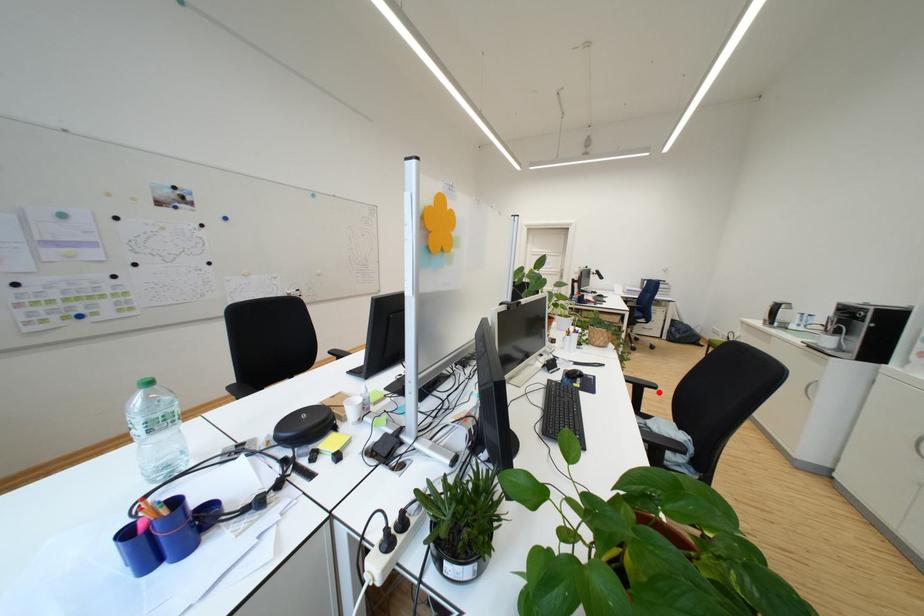
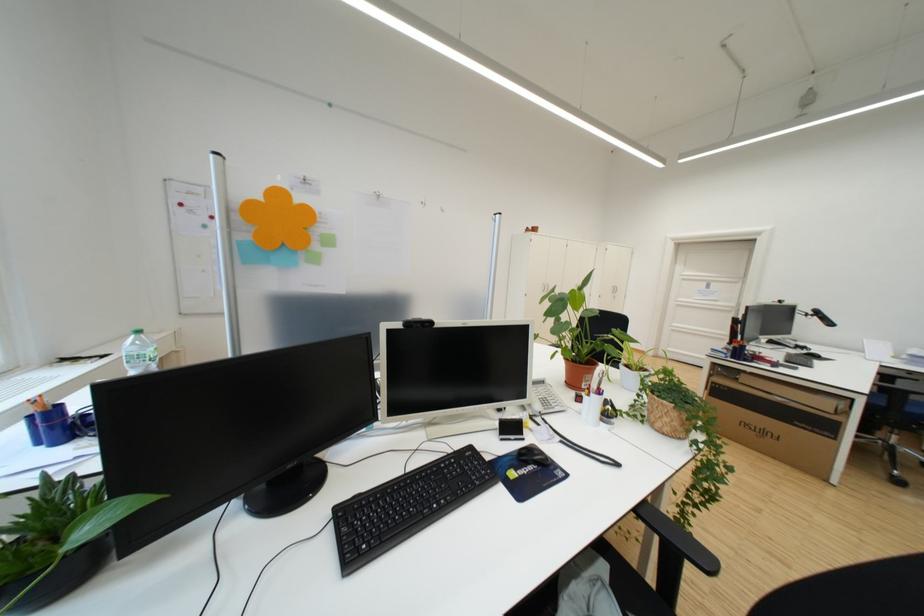
Where in the second image is the point corresponding to the highlighted location from the first image?

(700, 567)